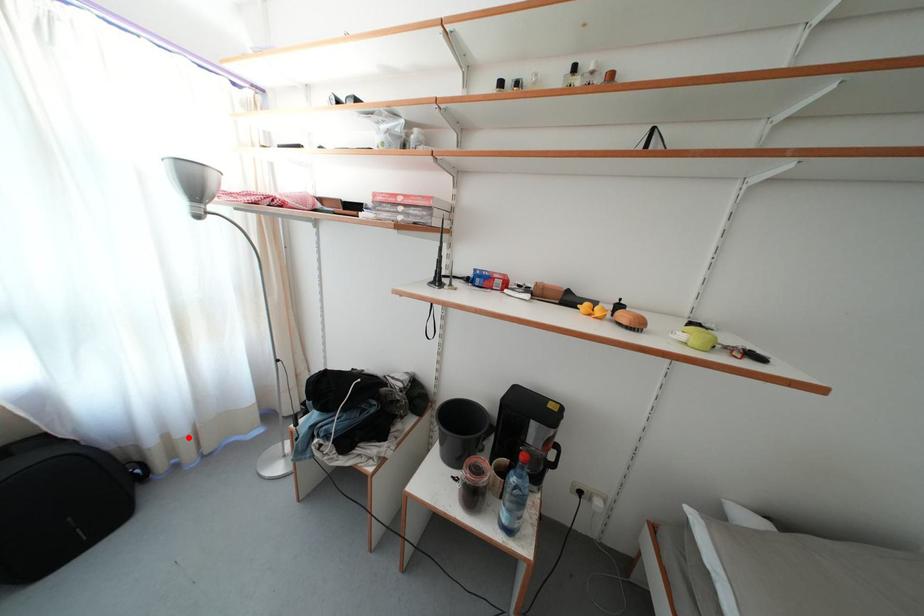
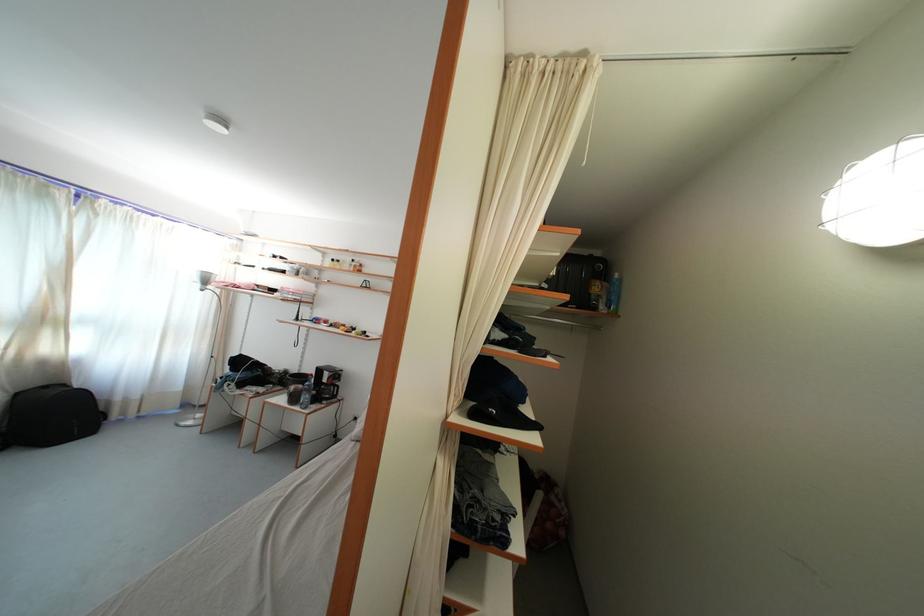
Question: I am providing you with two images of the same scene from different viewpoints. A red point is shown in image1. For the corresponding object point in image2, is it positioned nearer or farther from the camera?

Choices:
 (A) Nearer
 (B) Farther

Answer: (A)